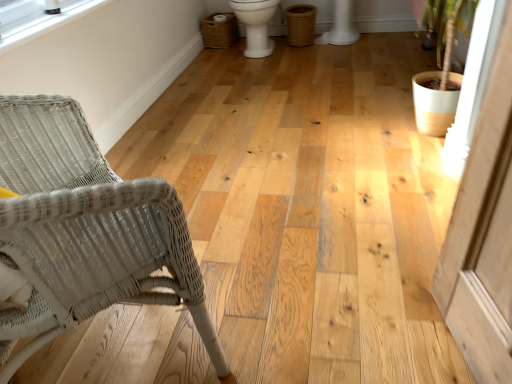
Identify the location of empty space that is in between white glossy toilet bowl at center and woven brown laundry basket at upper center. Image resolution: width=512 pixels, height=384 pixels. (217, 57).